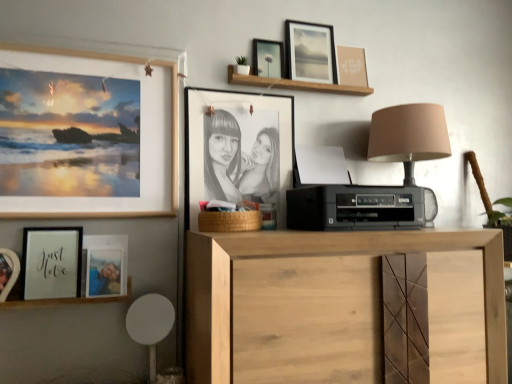
Question: Would you consider natural wood cabinet at center to be distant from matte black frame at upper center, the 3th picture frame viewed from the right?

Choices:
 (A) no
 (B) yes

Answer: (A)

Question: Considering the relative sizes of natural wood cabinet at center and matte black frame at upper center, which is counted as the 6th picture frame, starting from the left, in the image provided, is natural wood cabinet at center smaller than matte black frame at upper center, which is counted as the 6th picture frame, starting from the left,?

Choices:
 (A) yes
 (B) no

Answer: (B)

Question: From the image's perspective, is natural wood cabinet at center on matte black frame at upper center, which is counted as the 6th picture frame, starting from the left?

Choices:
 (A) no
 (B) yes

Answer: (A)

Question: Is matte black frame at upper center, the 3th picture frame viewed from the right, surrounded by natural wood cabinet at center?

Choices:
 (A) yes
 (B) no

Answer: (B)

Question: Considering the relative positions of natural wood cabinet at center and matte black frame at upper center, the 3th picture frame viewed from the right, in the image provided, is natural wood cabinet at center to the right of matte black frame at upper center, the 3th picture frame viewed from the right, from the viewer's perspective?

Choices:
 (A) no
 (B) yes

Answer: (B)

Question: Is point (73, 233) positioned closer to the camera than point (36, 304)?

Choices:
 (A) farther
 (B) closer

Answer: (A)

Question: Considering the relative positions of matte black frame at lower left, which ranks as the seventh picture frame in right-to-left order, and wooden frame at lower left, arranged as the 2th shelf when viewed from the top, in the image provided, is matte black frame at lower left, which ranks as the seventh picture frame in right-to-left order, to the left or to the right of wooden frame at lower left, arranged as the 2th shelf when viewed from the top,?

Choices:
 (A) right
 (B) left

Answer: (B)

Question: Which is correct: matte black frame at lower left, which ranks as the seventh picture frame in right-to-left order, is inside wooden frame at lower left, the 1th shelf positioned from the bottom, or outside of it?

Choices:
 (A) inside
 (B) outside

Answer: (B)

Question: In the image, is matte black frame at lower left, acting as the 2th picture frame starting from the left, positioned in front of or behind wooden frame at lower left, placed as the second shelf when sorted from right to left?

Choices:
 (A) behind
 (B) front

Answer: (A)

Question: From their relative heights in the image, would you say matte black frame at lower left, which ranks as the seventh picture frame in right-to-left order, is taller or shorter than white plastic swivel chair at lower left?

Choices:
 (A) short
 (B) tall

Answer: (A)

Question: In terms of width, does matte black frame at lower left, which ranks as the seventh picture frame in right-to-left order, look wider or thinner when compared to white plastic swivel chair at lower left?

Choices:
 (A) wide
 (B) thin

Answer: (B)

Question: Considering the positions of matte black frame at lower left, acting as the 2th picture frame starting from the left, and white plastic swivel chair at lower left in the image, is matte black frame at lower left, acting as the 2th picture frame starting from the left, bigger or smaller than white plastic swivel chair at lower left?

Choices:
 (A) big
 (B) small

Answer: (B)

Question: Is point (68, 248) positioned closer to the camera than point (155, 317)?

Choices:
 (A) farther
 (B) closer

Answer: (B)

Question: Is point (253, 44) closer or farther from the camera than point (24, 215)?

Choices:
 (A) farther
 (B) closer

Answer: (A)

Question: Is matte black frame at upper center, which is counted as the 6th picture frame, starting from the left, in front of or behind wooden picture frame at upper left, which ranks as the 6th picture frame in right-to-left order, in the image?

Choices:
 (A) behind
 (B) front

Answer: (A)